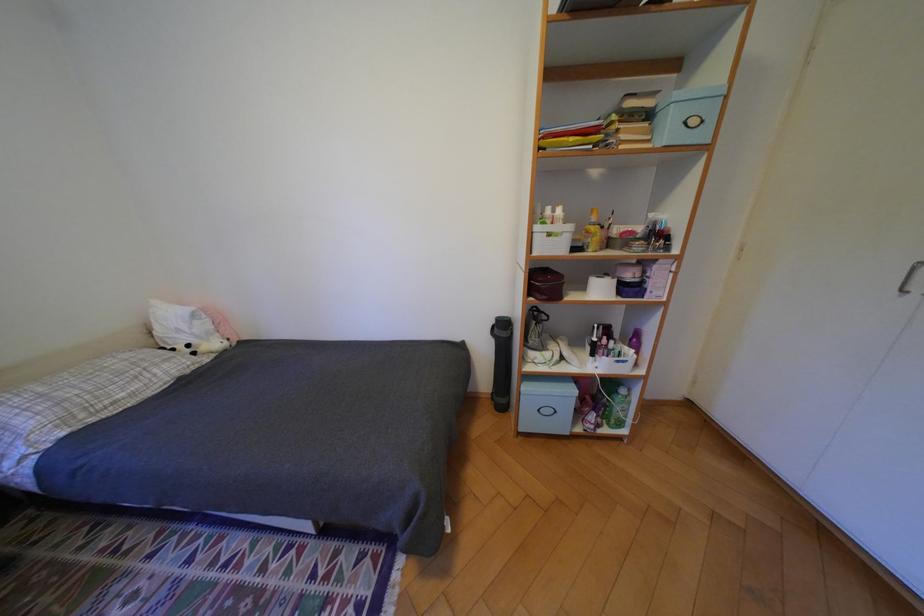
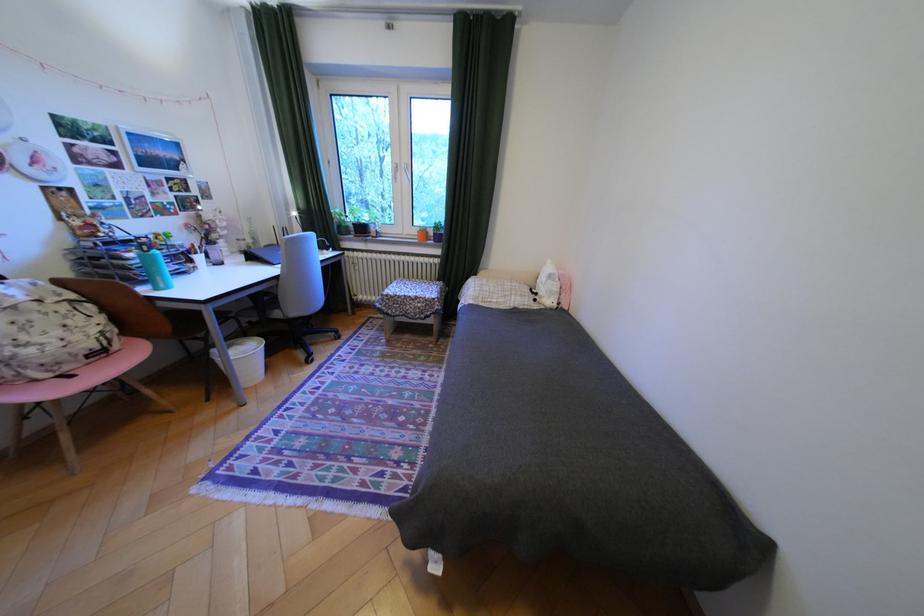
In the second image, find the point that corresponds to (201,346) in the first image.

(548, 294)